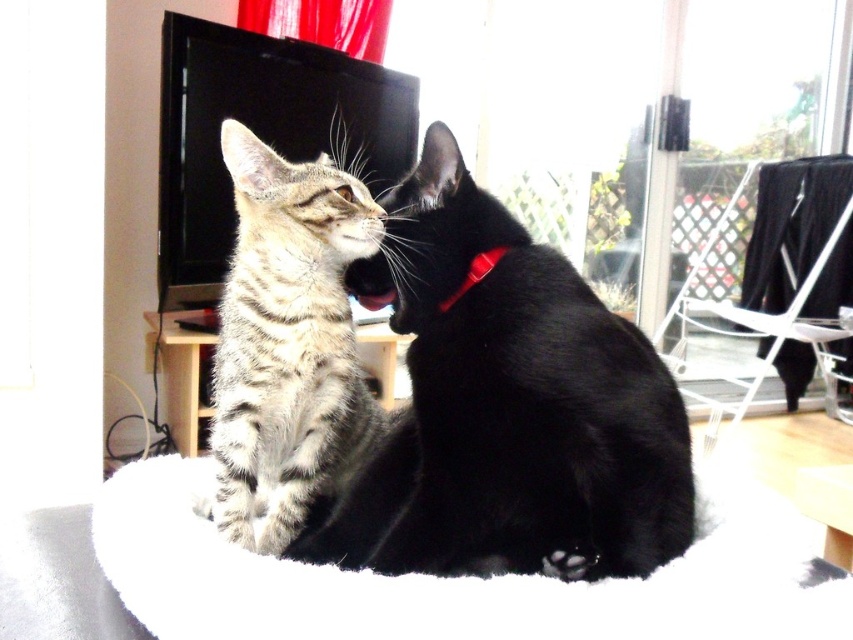
Looking at this image, can you confirm if tabby fur cat at center is smaller than striped fur cat at center?

Incorrect, tabby fur cat at center is not smaller in size than striped fur cat at center.

Who is higher up, tabby fur cat at center or striped fur cat at center?

striped fur cat at center

The image size is (853, 640). I want to click on tabby fur cat at center, so click(508, 406).

Can you confirm if tabby fur cat at center is bigger than white fluffy cat bed at center?

Correct, tabby fur cat at center is larger in size than white fluffy cat bed at center.

What do you see at coordinates (508, 406) in the screenshot? The height and width of the screenshot is (640, 853). I see `tabby fur cat at center` at bounding box center [508, 406].

Who is more distant from viewer, (426, 282) or (619, 611)?

Positioned behind is point (426, 282).

Locate an element on the screen. This screenshot has height=640, width=853. tabby fur cat at center is located at coordinates (508, 406).

Who is positioned more to the left, white fluffy cat bed at center or red plastic neckband at center?

white fluffy cat bed at center

Is point (746, 534) behind point (480, 264)?

No, (746, 534) is closer to viewer.

You are a GUI agent. You are given a task and a screenshot of the screen. Output one action in this format:
    pyautogui.click(x=<x>, y=<y>)
    Task: Click on the white fluffy cat bed at center
    
    Given the screenshot: What is the action you would take?
    pyautogui.click(x=459, y=577)